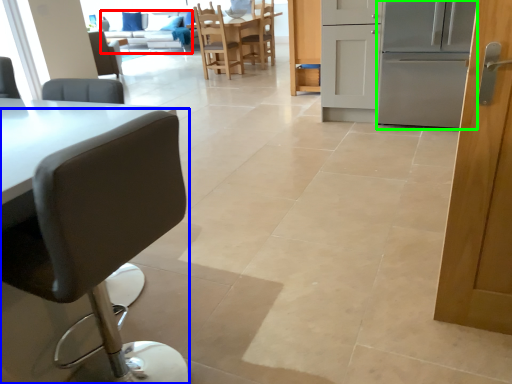
Question: Which is nearer to the couch (highlighted by a red box)? chair (highlighted by a blue box) or oven (highlighted by a green box).

Choices:
 (A) chair
 (B) oven

Answer: (B)